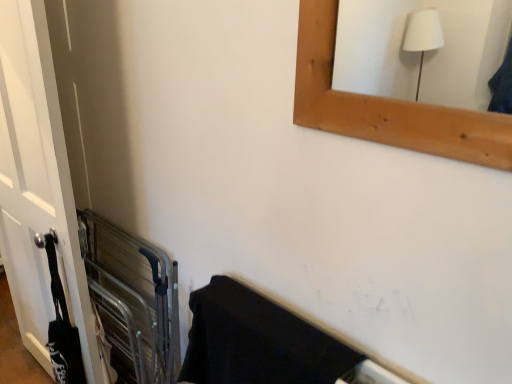
Question: Is white matte door at left oriented away from metallic gray balustrade at left?

Choices:
 (A) no
 (B) yes

Answer: (B)

Question: Is white matte door at left outside metallic gray balustrade at left?

Choices:
 (A) yes
 (B) no

Answer: (A)

Question: Can you confirm if white matte door at left is wider than metallic gray balustrade at left?

Choices:
 (A) yes
 (B) no

Answer: (B)

Question: Is white matte door at left smaller than metallic gray balustrade at left?

Choices:
 (A) no
 (B) yes

Answer: (B)

Question: Considering the relative sizes of white matte door at left and metallic gray balustrade at left in the image provided, is white matte door at left shorter than metallic gray balustrade at left?

Choices:
 (A) no
 (B) yes

Answer: (A)

Question: Does white matte door at left turn towards metallic gray balustrade at left?

Choices:
 (A) no
 (B) yes

Answer: (B)

Question: Is metallic gray balustrade at left facing towards white matte door at left?

Choices:
 (A) yes
 (B) no

Answer: (A)

Question: Is metallic gray balustrade at left in front of white matte door at left?

Choices:
 (A) no
 (B) yes

Answer: (A)

Question: Is metallic gray balustrade at left thinner than white matte door at left?

Choices:
 (A) yes
 (B) no

Answer: (B)

Question: Is metallic gray balustrade at left outside of white matte door at left?

Choices:
 (A) yes
 (B) no

Answer: (A)

Question: Is metallic gray balustrade at left to the right of white matte door at left from the viewer's perspective?

Choices:
 (A) yes
 (B) no

Answer: (A)

Question: Considering the relative sizes of metallic gray balustrade at left and white matte door at left in the image provided, is metallic gray balustrade at left smaller than white matte door at left?

Choices:
 (A) yes
 (B) no

Answer: (B)

Question: Is white matte door at left placed right next to black matte towel at lower right?

Choices:
 (A) no
 (B) yes

Answer: (A)